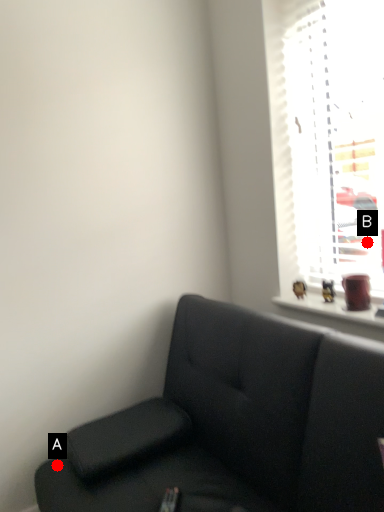
Question: Two points are circled on the image, labeled by A and B beside each circle. Which point appears closest to the camera in this image?

Choices:
 (A) A is closer
 (B) B is closer

Answer: (A)